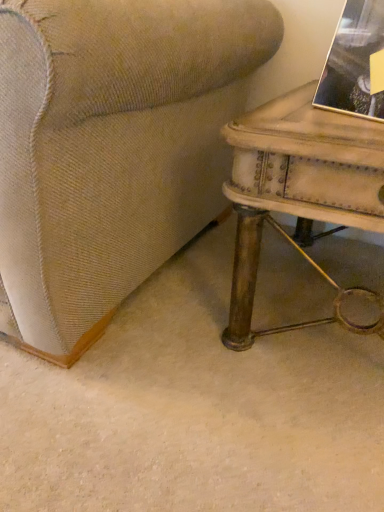
Question: Can you see gold-framed photo at upper right touching rustic wood table at right?

Choices:
 (A) no
 (B) yes

Answer: (A)

Question: Can you confirm if gold-framed photo at upper right is bigger than rustic wood table at right?

Choices:
 (A) no
 (B) yes

Answer: (A)

Question: Can you confirm if gold-framed photo at upper right is positioned to the right of rustic wood table at right?

Choices:
 (A) yes
 (B) no

Answer: (A)

Question: From the image's perspective, is gold-framed photo at upper right below rustic wood table at right?

Choices:
 (A) yes
 (B) no

Answer: (B)

Question: Does gold-framed photo at upper right have a greater height compared to rustic wood table at right?

Choices:
 (A) no
 (B) yes

Answer: (A)

Question: Considering the relative sizes of gold-framed photo at upper right and rustic wood table at right in the image provided, is gold-framed photo at upper right smaller than rustic wood table at right?

Choices:
 (A) no
 (B) yes

Answer: (B)

Question: From the image's perspective, is rustic wood table at right on gold-framed photo at upper right?

Choices:
 (A) yes
 (B) no

Answer: (B)

Question: Is rustic wood table at right thinner than gold-framed photo at upper right?

Choices:
 (A) yes
 (B) no

Answer: (B)

Question: Does rustic wood table at right lie behind gold-framed photo at upper right?

Choices:
 (A) yes
 (B) no

Answer: (B)

Question: Is rustic wood table at right bigger than gold-framed photo at upper right?

Choices:
 (A) no
 (B) yes

Answer: (B)

Question: Does rustic wood table at right have a greater width compared to gold-framed photo at upper right?

Choices:
 (A) yes
 (B) no

Answer: (A)

Question: Can you confirm if rustic wood table at right is positioned to the left of gold-framed photo at upper right?

Choices:
 (A) yes
 (B) no

Answer: (A)

Question: Which is correct: rustic wood table at right is inside gold-framed photo at upper right, or outside of it?

Choices:
 (A) inside
 (B) outside

Answer: (B)